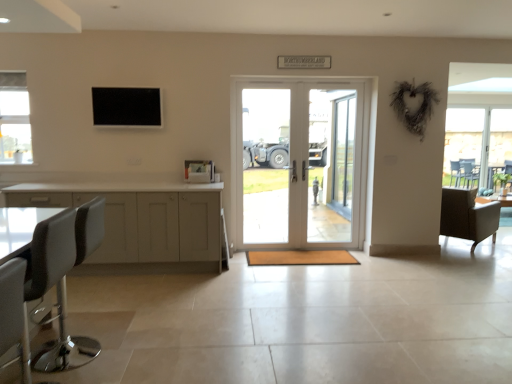
Question: Is white leather bar stool at left, positioned as the 2th chair in back-to-front order, shorter than leather-like brown armchair at right, which appears as the second chair when viewed from the front?

Choices:
 (A) yes
 (B) no

Answer: (B)

Question: Considering the relative sizes of white leather bar stool at left, positioned as the 1th chair in left-to-right order, and leather-like brown armchair at right, positioned as the 2th chair in left-to-right order, in the image provided, is white leather bar stool at left, positioned as the 1th chair in left-to-right order, bigger than leather-like brown armchair at right, positioned as the 2th chair in left-to-right order,?

Choices:
 (A) no
 (B) yes

Answer: (A)

Question: Is white leather bar stool at left, positioned as the 2th chair in back-to-front order, to the left of leather-like brown armchair at right, positioned as the 2th chair in left-to-right order, from the viewer's perspective?

Choices:
 (A) yes
 (B) no

Answer: (A)

Question: Does white leather bar stool at left, positioned as the 1th chair in left-to-right order, have a greater width compared to leather-like brown armchair at right, which appears as the first chair when viewed from the right?

Choices:
 (A) no
 (B) yes

Answer: (A)

Question: Does white leather bar stool at left, positioned as the 2th chair in right-to-left order, have a smaller size compared to leather-like brown armchair at right, positioned as the 2th chair in left-to-right order?

Choices:
 (A) yes
 (B) no

Answer: (A)

Question: Relative to leather-like brown armchair at right, which appears as the second chair when viewed from the front, is white matte cabinet at left in front or behind?

Choices:
 (A) behind
 (B) front

Answer: (B)

Question: Considering the positions of white matte cabinet at left and leather-like brown armchair at right, the first chair from the back, in the image, is white matte cabinet at left bigger or smaller than leather-like brown armchair at right, the first chair from the back,?

Choices:
 (A) big
 (B) small

Answer: (A)

Question: Is point (14, 196) positioned closer to the camera than point (470, 226)?

Choices:
 (A) closer
 (B) farther

Answer: (A)

Question: Visually, is white matte cabinet at left positioned to the left or to the right of leather-like brown armchair at right, the first chair from the back?

Choices:
 (A) right
 (B) left

Answer: (B)

Question: In the image, is white glossy door at center positioned in front of or behind white matte cabinet at left?

Choices:
 (A) front
 (B) behind

Answer: (B)

Question: Is point (323, 114) closer or farther from the camera than point (220, 238)?

Choices:
 (A) closer
 (B) farther

Answer: (B)

Question: From their relative heights in the image, would you say white glossy door at center is taller or shorter than white matte cabinet at left?

Choices:
 (A) short
 (B) tall

Answer: (B)

Question: Is white glossy door at center situated inside white matte cabinet at left or outside?

Choices:
 (A) outside
 (B) inside

Answer: (A)

Question: In the image, is leather-like brown armchair at right, the first chair from the back, positioned in front of or behind black leather swivel chair at lower left?

Choices:
 (A) front
 (B) behind

Answer: (B)

Question: In terms of width, does leather-like brown armchair at right, positioned as the 2th chair in left-to-right order, look wider or thinner when compared to black leather swivel chair at lower left?

Choices:
 (A) wide
 (B) thin

Answer: (A)